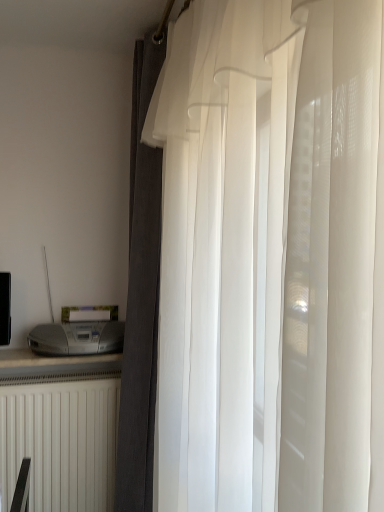
The image size is (384, 512). What do you see at coordinates (271, 252) in the screenshot?
I see `translucent white curtain at center, positioned as the 1th curtain in front-to-back order` at bounding box center [271, 252].

In order to face white matte radiator at lower left, should I rotate leftwards or rightwards?

A 17.108 degree turn to the left will do.

What is the approximate width of white matte radiator at lower left?

white matte radiator at lower left is 8.35 inches wide.

Locate an element on the screen. satin silver printer at lower left is located at coordinates (77, 338).

Identify the location of the 2nd curtain above the satin silver printer at lower left (from a real-world perspective). Image resolution: width=384 pixels, height=512 pixels. (271, 252).

From a real-world perspective, is satin silver printer at lower left below translucent white curtain at center, positioned as the 1th curtain in front-to-back order?

Correct, in the physical world, satin silver printer at lower left is lower than translucent white curtain at center, positioned as the 1th curtain in front-to-back order.

Considering the relative sizes of satin silver printer at lower left and translucent white curtain at center, positioned as the 1th curtain in front-to-back order, in the image provided, is satin silver printer at lower left bigger than translucent white curtain at center, positioned as the 1th curtain in front-to-back order,?

No.

Considering the relative positions of satin silver printer at lower left and translucent white curtain at center, the second curtain from the back, in the image provided, is satin silver printer at lower left behind translucent white curtain at center, the second curtain from the back,?

Yes, satin silver printer at lower left is further from the viewer.

Which is in front, white matte radiator at lower left or dark gray textured curtain at center, the second curtain from the front?

dark gray textured curtain at center, the second curtain from the front.

Does white matte radiator at lower left have a greater width compared to dark gray textured curtain at center, arranged as the 1th curtain when viewed from the back?

Correct, the width of white matte radiator at lower left exceeds that of dark gray textured curtain at center, arranged as the 1th curtain when viewed from the back.

Can you confirm if white matte radiator at lower left is smaller than dark gray textured curtain at center, arranged as the 1th curtain when viewed from the back?

Yes.

Would you say dark gray textured curtain at center, arranged as the 1th curtain when viewed from the back, is part of satin silver printer at lower left's contents?

Definitely not — dark gray textured curtain at center, arranged as the 1th curtain when viewed from the back, is not inside satin silver printer at lower left.

Are satin silver printer at lower left and dark gray textured curtain at center, the second curtain from the front, beside each other?

No, satin silver printer at lower left is not making contact with dark gray textured curtain at center, the second curtain from the front.

Which object is positioned more to the left, satin silver printer at lower left or dark gray textured curtain at center, arranged as the 1th curtain when viewed from the back?

satin silver printer at lower left is more to the left.

Considering the sizes of satin silver printer at lower left and dark gray textured curtain at center, the second curtain from the front, in the image, is satin silver printer at lower left bigger or smaller than dark gray textured curtain at center, the second curtain from the front,?

Considering their sizes, satin silver printer at lower left takes up less space than dark gray textured curtain at center, the second curtain from the front.

Is dark gray textured curtain at center, the second curtain from the front, in contact with white matte radiator at lower left?

No, dark gray textured curtain at center, the second curtain from the front, is not in contact with white matte radiator at lower left.

The width and height of the screenshot is (384, 512). I want to click on radiator behind the dark gray textured curtain at center, the second curtain from the front, so click(x=61, y=444).

Does dark gray textured curtain at center, arranged as the 1th curtain when viewed from the back, have a smaller size compared to white matte radiator at lower left?

Actually, dark gray textured curtain at center, arranged as the 1th curtain when viewed from the back, might be larger than white matte radiator at lower left.

Is dark gray textured curtain at center, arranged as the 1th curtain when viewed from the back, not inside white matte radiator at lower left?

Yes, dark gray textured curtain at center, arranged as the 1th curtain when viewed from the back, is outside of white matte radiator at lower left.

Considering the sizes of white matte radiator at lower left and satin silver printer at lower left in the image, is white matte radiator at lower left taller or shorter than satin silver printer at lower left?

Considering their sizes, white matte radiator at lower left has more height than satin silver printer at lower left.

Does white matte radiator at lower left have a greater width compared to satin silver printer at lower left?

Incorrect, the width of white matte radiator at lower left does not surpass that of satin silver printer at lower left.

Between white matte radiator at lower left and satin silver printer at lower left, which one is positioned in front?

satin silver printer at lower left.

Which is behind, point (43, 499) or point (71, 324)?

The point (71, 324) is farther.

Between point (132, 510) and point (217, 104), which one is positioned in front?

The point (217, 104) is closer.

Between dark gray textured curtain at center, arranged as the 1th curtain when viewed from the back, and translucent white curtain at center, the second curtain from the back, which one has more height?

dark gray textured curtain at center, arranged as the 1th curtain when viewed from the back, is taller.

Who is bigger, dark gray textured curtain at center, the second curtain from the front, or translucent white curtain at center, the second curtain from the back?

With larger size is translucent white curtain at center, the second curtain from the back.

Is dark gray textured curtain at center, arranged as the 1th curtain when viewed from the back, positioned beyond the bounds of translucent white curtain at center, the second curtain from the back?

Yes, dark gray textured curtain at center, arranged as the 1th curtain when viewed from the back, is outside of translucent white curtain at center, the second curtain from the back.

From the picture: Is satin silver printer at lower left far away from white matte radiator at lower left?

satin silver printer at lower left is near white matte radiator at lower left, not far away.

Considering the positions of point (56, 340) and point (57, 458), is point (56, 340) closer or farther from the camera than point (57, 458)?

Point (56, 340) appears to be closer to the viewer than point (57, 458).

Is satin silver printer at lower left to the left or to the right of white matte radiator at lower left in the image?

In the image, satin silver printer at lower left appears on the right side of white matte radiator at lower left.

Does satin silver printer at lower left have a larger size compared to white matte radiator at lower left?

No, satin silver printer at lower left is not bigger than white matte radiator at lower left.

Where is `appliance below the translucent white curtain at center, positioned as the 1th curtain in front-to-back order (from the image's perspective)`? The height and width of the screenshot is (512, 384). appliance below the translucent white curtain at center, positioned as the 1th curtain in front-to-back order (from the image's perspective) is located at coordinates (77, 338).

At what (x,y) coordinates should I click in order to perform the action: click on radiator on the left side of dark gray textured curtain at center, the second curtain from the front. Please return your answer as a coordinate pair (x, y). This screenshot has width=384, height=512. Looking at the image, I should click on pyautogui.click(x=61, y=444).

Estimate the real-world distances between objects in this image. Which object is further from satin silver printer at lower left, white matte radiator at lower left or dark gray textured curtain at center, arranged as the 1th curtain when viewed from the back?

The object further to satin silver printer at lower left is white matte radiator at lower left.

Estimate the real-world distances between objects in this image. Which object is further from dark gray textured curtain at center, the second curtain from the front, satin silver printer at lower left or white matte radiator at lower left?

white matte radiator at lower left is positioned further to the anchor dark gray textured curtain at center, the second curtain from the front.

Considering their positions, is translucent white curtain at center, positioned as the 1th curtain in front-to-back order, positioned closer to white matte radiator at lower left than dark gray textured curtain at center, the second curtain from the front?

dark gray textured curtain at center, the second curtain from the front.

From the image, which object appears to be farther from dark gray textured curtain at center, the second curtain from the front, white matte radiator at lower left or satin silver printer at lower left?

Based on the image, white matte radiator at lower left appears to be further to dark gray textured curtain at center, the second curtain from the front.

Looking at the image, which one is located closer to white matte radiator at lower left, satin silver printer at lower left or dark gray textured curtain at center, arranged as the 1th curtain when viewed from the back?

dark gray textured curtain at center, arranged as the 1th curtain when viewed from the back, lies closer to white matte radiator at lower left than the other object.

Based on their spatial positions, is translucent white curtain at center, the second curtain from the back, or dark gray textured curtain at center, arranged as the 1th curtain when viewed from the back, further from satin silver printer at lower left?

translucent white curtain at center, the second curtain from the back, is further to satin silver printer at lower left.

Considering their positions, is dark gray textured curtain at center, the second curtain from the front, positioned further to translucent white curtain at center, positioned as the 1th curtain in front-to-back order, than white matte radiator at lower left?

The object further to translucent white curtain at center, positioned as the 1th curtain in front-to-back order, is white matte radiator at lower left.

Estimate the real-world distances between objects in this image. Which object is closer to satin silver printer at lower left, white matte radiator at lower left or translucent white curtain at center, positioned as the 1th curtain in front-to-back order?

The object closer to satin silver printer at lower left is white matte radiator at lower left.

This screenshot has height=512, width=384. I want to click on curtain between translucent white curtain at center, positioned as the 1th curtain in front-to-back order, and satin silver printer at lower left in the front-back direction, so click(x=141, y=296).

The image size is (384, 512). Find the location of `appliance between translucent white curtain at center, the second curtain from the back, and white matte radiator at lower left in the front-back direction`. appliance between translucent white curtain at center, the second curtain from the back, and white matte radiator at lower left in the front-back direction is located at coordinates (77, 338).

The height and width of the screenshot is (512, 384). In order to click on curtain between translucent white curtain at center, positioned as the 1th curtain in front-to-back order, and white matte radiator at lower left from front to back in this screenshot , I will do `click(141, 296)`.

Identify the location of appliance between dark gray textured curtain at center, the second curtain from the front, and white matte radiator at lower left from top to bottom. This screenshot has width=384, height=512. (77, 338).